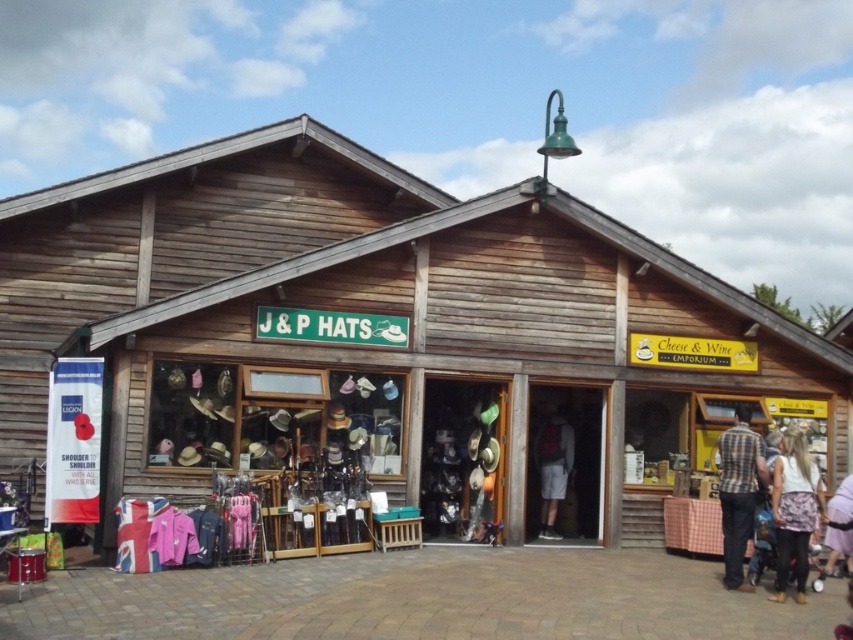
Is wooden building at center above dark gray fabric shorts at center?

Correct, wooden building at center is located above dark gray fabric shorts at center.

Does wooden building at center have a greater width compared to dark gray fabric shorts at center?

Correct, the width of wooden building at center exceeds that of dark gray fabric shorts at center.

Does point (663, 477) lie in front of point (552, 520)?

Yes, it is in front of point (552, 520).

Identify the location of wooden building at center. The width and height of the screenshot is (853, 640). (386, 336).

Is floral skirt at lower right in front of plaid shirt at center?

Yes, it is.

Which is in front, point (805, 500) or point (743, 500)?

Point (805, 500) is in front.

Locate an element on the screen. This screenshot has width=853, height=640. floral skirt at lower right is located at coordinates (793, 509).

Which is more to the left, plaid shirt at center or dark gray fabric shorts at center?

dark gray fabric shorts at center

Does plaid shirt at center appear over dark gray fabric shorts at center?

Correct, plaid shirt at center is located above dark gray fabric shorts at center.

Find the location of a particular element. The image size is (853, 640). plaid shirt at center is located at coordinates (738, 492).